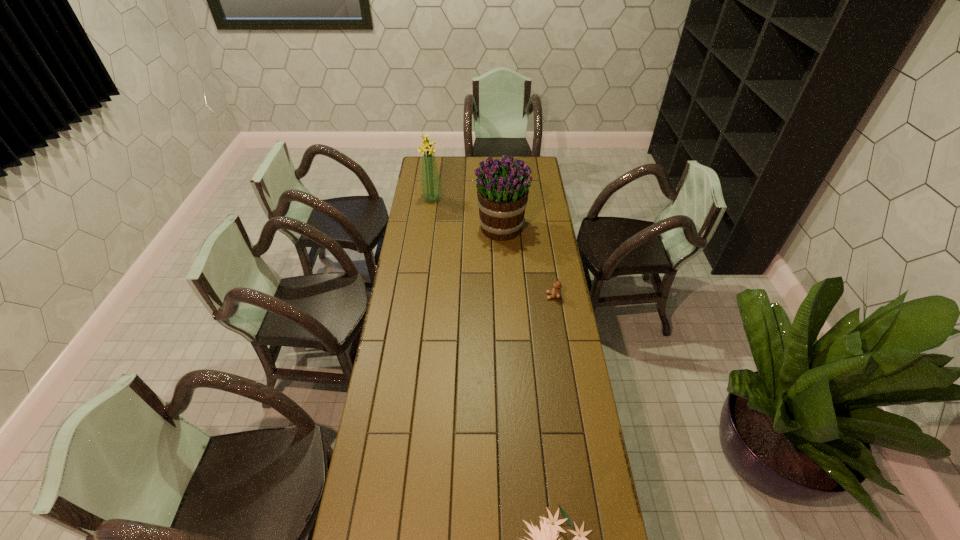
Where is `the third nearest object`? This screenshot has width=960, height=540. the third nearest object is located at coordinates (502, 190).

Identify the location of the farthest object. (431, 191).

Identify the location of the farthest bouquet. Image resolution: width=960 pixels, height=540 pixels. click(431, 191).

Locate an element on the screen. This screenshot has height=540, width=960. the third farthest object is located at coordinates (556, 292).

Where is `the shortest object`? the shortest object is located at coordinates (556, 292).

The width and height of the screenshot is (960, 540). Identify the location of free space located 0.330m on the back of the second nearest bouquet. (498, 179).

This screenshot has height=540, width=960. What are the coordinates of `vacant area located on the front-facing side of the farthest object` in the screenshot? It's located at (456, 198).

Identify the location of free space located 0.240m on the front-facing side of the second nearest object. (492, 296).

Find the location of a particular element. vacant space located on the front-facing side of the second nearest object is located at coordinates (477, 296).

Image resolution: width=960 pixels, height=540 pixels. I want to click on vacant space located on the front-facing side of the second nearest object, so click(x=470, y=296).